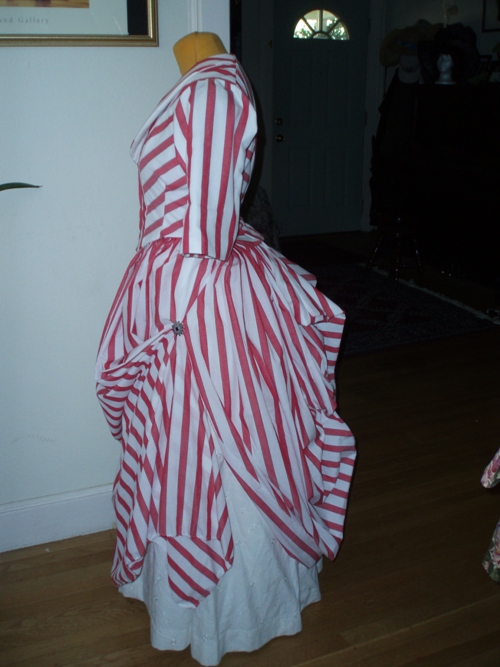
You are a GUI agent. You are given a task and a screenshot of the screen. Output one action in this format:
    pyautogui.click(x=<x>, y=<y>)
    Task: Click on the wood floor
    The image size is (500, 667).
    Given the screenshot: What is the action you would take?
    pyautogui.click(x=381, y=639), pyautogui.click(x=418, y=479)